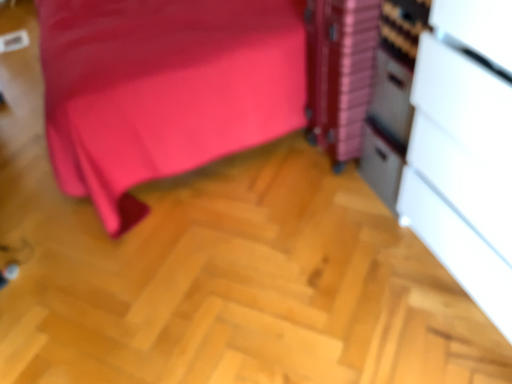
Describe the element at coordinates (464, 151) in the screenshot. I see `white matte/file cabinet at right, the first file cabinet from the front` at that location.

The image size is (512, 384). In order to click on white matte/file cabinet at right, which is the 2th file cabinet in back-to-front order in this screenshot , I will do `click(464, 151)`.

Find the location of a particular element. This screenshot has width=512, height=384. metallic silver file cabinet at right, the first file cabinet positioned from the back is located at coordinates click(339, 73).

The width and height of the screenshot is (512, 384). What do you see at coordinates (339, 73) in the screenshot?
I see `metallic silver file cabinet at right, the first file cabinet positioned from the back` at bounding box center [339, 73].

Where is `white matte/file cabinet at right, which is the 2th file cabinet in back-to-front order`? This screenshot has height=384, width=512. white matte/file cabinet at right, which is the 2th file cabinet in back-to-front order is located at coordinates (464, 151).

Consider the image. Which is more to the right, metallic silver file cabinet at right, which is counted as the 2th file cabinet, starting from the front, or white matte/file cabinet at right, which is the 2th file cabinet in back-to-front order?

Positioned to the right is white matte/file cabinet at right, which is the 2th file cabinet in back-to-front order.

Is the depth of metallic silver file cabinet at right, which is counted as the 2th file cabinet, starting from the front, greater than that of white matte/file cabinet at right, which is the 2th file cabinet in back-to-front order?

That is True.

Which point is more distant from viewer, (349, 62) or (430, 174)?

Positioned behind is point (349, 62).

From the image's perspective, does metallic silver file cabinet at right, the first file cabinet positioned from the back, appear lower than white matte/file cabinet at right, which is the 2th file cabinet in back-to-front order?

No.

From a real-world perspective, is metallic silver file cabinet at right, the first file cabinet positioned from the back, physically located above or below white matte/file cabinet at right, which is the 2th file cabinet in back-to-front order?

From a real-world perspective, metallic silver file cabinet at right, the first file cabinet positioned from the back, is physically below white matte/file cabinet at right, which is the 2th file cabinet in back-to-front order.

Is metallic silver file cabinet at right, the first file cabinet positioned from the back, thinner than white matte/file cabinet at right, the first file cabinet from the front?

Indeed, metallic silver file cabinet at right, the first file cabinet positioned from the back, has a lesser width compared to white matte/file cabinet at right, the first file cabinet from the front.

Between metallic silver file cabinet at right, the first file cabinet positioned from the back, and white matte/file cabinet at right, which is the 2th file cabinet in back-to-front order, which one has less height?

With less height is metallic silver file cabinet at right, the first file cabinet positioned from the back.

Is metallic silver file cabinet at right, which is counted as the 2th file cabinet, starting from the front, smaller than white matte/file cabinet at right, the first file cabinet from the front?

Indeed, metallic silver file cabinet at right, which is counted as the 2th file cabinet, starting from the front, has a smaller size compared to white matte/file cabinet at right, the first file cabinet from the front.

Is metallic silver file cabinet at right, which is counted as the 2th file cabinet, starting from the front, positioned beyond the bounds of white matte/file cabinet at right, the first file cabinet from the front?

That's correct, metallic silver file cabinet at right, which is counted as the 2th file cabinet, starting from the front, is outside of white matte/file cabinet at right, the first file cabinet from the front.

Is the surface of metallic silver file cabinet at right, which is counted as the 2th file cabinet, starting from the front, in direct contact with white matte/file cabinet at right, the first file cabinet from the front?

metallic silver file cabinet at right, which is counted as the 2th file cabinet, starting from the front, is not next to white matte/file cabinet at right, the first file cabinet from the front, and they're not touching.

Is metallic silver file cabinet at right, the first file cabinet positioned from the back, oriented away from white matte/file cabinet at right, the first file cabinet from the front?

metallic silver file cabinet at right, the first file cabinet positioned from the back, is not turned away from white matte/file cabinet at right, the first file cabinet from the front.

What's the angular difference between metallic silver file cabinet at right, the first file cabinet positioned from the back, and white matte/file cabinet at right, the first file cabinet from the front,'s facing directions?

0.0297 degrees.

At what (x,y) coordinates should I click in order to perform the action: click on file cabinet located above the metallic silver file cabinet at right, the first file cabinet positioned from the back (from a real-world perspective). Please return your answer as a coordinate pair (x, y). Looking at the image, I should click on (464, 151).

Based on the photo, which is more to the right, white matte/file cabinet at right, which is the 2th file cabinet in back-to-front order, or metallic silver file cabinet at right, which is counted as the 2th file cabinet, starting from the front?

white matte/file cabinet at right, which is the 2th file cabinet in back-to-front order, is more to the right.

Between white matte/file cabinet at right, the first file cabinet from the front, and metallic silver file cabinet at right, the first file cabinet positioned from the back, which one is positioned behind?

metallic silver file cabinet at right, the first file cabinet positioned from the back, is behind.

Which is in front, point (462, 9) or point (328, 46)?

The point (462, 9) is in front.

Looking at this image, from the image's perspective, is white matte/file cabinet at right, the first file cabinet from the front, located above metallic silver file cabinet at right, which is counted as the 2th file cabinet, starting from the front?

No, from the image's perspective, white matte/file cabinet at right, the first file cabinet from the front, is not above metallic silver file cabinet at right, which is counted as the 2th file cabinet, starting from the front.

From a real-world perspective, which is physically below, white matte/file cabinet at right, which is the 2th file cabinet in back-to-front order, or metallic silver file cabinet at right, the first file cabinet positioned from the back?

metallic silver file cabinet at right, the first file cabinet positioned from the back, is physically lower.

Is white matte/file cabinet at right, the first file cabinet from the front, thinner than metallic silver file cabinet at right, which is counted as the 2th file cabinet, starting from the front?

Incorrect, the width of white matte/file cabinet at right, the first file cabinet from the front, is not less than that of metallic silver file cabinet at right, which is counted as the 2th file cabinet, starting from the front.

Who is shorter, white matte/file cabinet at right, the first file cabinet from the front, or metallic silver file cabinet at right, which is counted as the 2th file cabinet, starting from the front?

metallic silver file cabinet at right, which is counted as the 2th file cabinet, starting from the front.

Is white matte/file cabinet at right, which is the 2th file cabinet in back-to-front order, smaller than metallic silver file cabinet at right, the first file cabinet positioned from the back?

No, white matte/file cabinet at right, which is the 2th file cabinet in back-to-front order, is not smaller than metallic silver file cabinet at right, the first file cabinet positioned from the back.

Is white matte/file cabinet at right, the first file cabinet from the front, completely or partially outside of metallic silver file cabinet at right, the first file cabinet positioned from the back?

Indeed, white matte/file cabinet at right, the first file cabinet from the front, is completely outside metallic silver file cabinet at right, the first file cabinet positioned from the back.

Is white matte/file cabinet at right, which is the 2th file cabinet in back-to-front order, positioned far away from metallic silver file cabinet at right, the first file cabinet positioned from the back?

white matte/file cabinet at right, which is the 2th file cabinet in back-to-front order, is near metallic silver file cabinet at right, the first file cabinet positioned from the back, not far away.

Could you tell me if white matte/file cabinet at right, the first file cabinet from the front, is facing metallic silver file cabinet at right, the first file cabinet positioned from the back?

No, white matte/file cabinet at right, the first file cabinet from the front, is not turned towards metallic silver file cabinet at right, the first file cabinet positioned from the back.

Find the location of a particular element. The height and width of the screenshot is (384, 512). file cabinet that appears behind the white matte/file cabinet at right, which is the 2th file cabinet in back-to-front order is located at coordinates (339, 73).

The image size is (512, 384). In the image, there is a metallic silver file cabinet at right, the first file cabinet positioned from the back. What are the coordinates of `file cabinet below it (from the image's perspective)` in the screenshot? It's located at (464, 151).

The height and width of the screenshot is (384, 512). I want to click on file cabinet on the right of metallic silver file cabinet at right, the first file cabinet positioned from the back, so click(x=464, y=151).